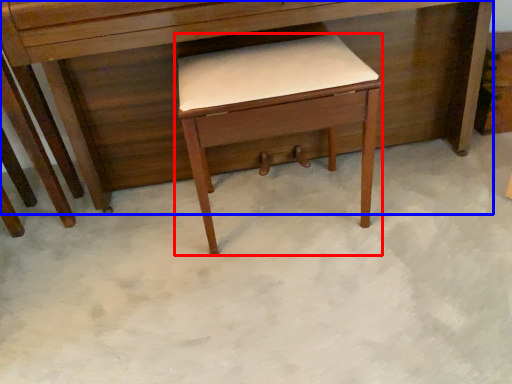
Question: Which object appears closest to the camera in this image, table (highlighted by a red box) or desk (highlighted by a blue box)?

Choices:
 (A) table
 (B) desk

Answer: (B)